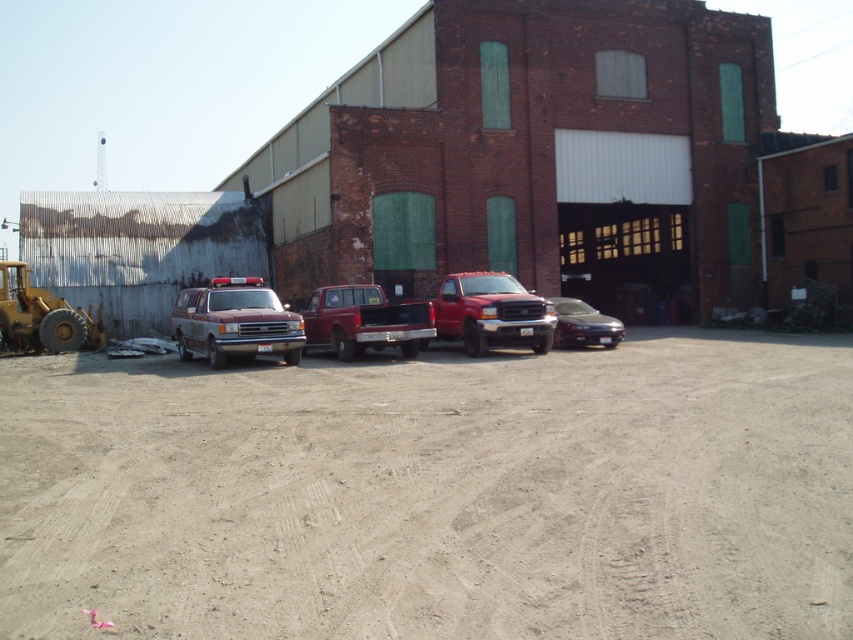
Consider the image. Is matte red truck at center to the left of satin silver sedan at center from the viewer's perspective?

Yes, matte red truck at center is to the left of satin silver sedan at center.

Between matte red truck at center and satin silver sedan at center, which one has less height?

Standing shorter between the two is matte red truck at center.

The height and width of the screenshot is (640, 853). What do you see at coordinates (364, 321) in the screenshot? I see `matte red truck at center` at bounding box center [364, 321].

At what (x,y) coordinates should I click in order to perform the action: click on matte red truck at center. Please return your answer as a coordinate pair (x, y). Image resolution: width=853 pixels, height=640 pixels. Looking at the image, I should click on coord(364,321).

Consider the image. Is maroon matte van at center to the right of satin silver sedan at center from the viewer's perspective?

No, maroon matte van at center is not to the right of satin silver sedan at center.

Does maroon matte van at center have a smaller size compared to satin silver sedan at center?

Incorrect, maroon matte van at center is not smaller in size than satin silver sedan at center.

Identify the location of maroon matte van at center. The height and width of the screenshot is (640, 853). (234, 323).

Which is behind, point (248, 314) or point (372, 308)?

The point (372, 308) is behind.

Can you confirm if maroon matte van at center is taller than matte red truck at center?

Indeed, maroon matte van at center has a greater height compared to matte red truck at center.

Which is in front, point (244, 348) or point (302, 349)?

Point (244, 348) is in front.

At what (x,y) coordinates should I click in order to perform the action: click on maroon matte van at center. Please return your answer as a coordinate pair (x, y). Looking at the image, I should click on (234, 323).